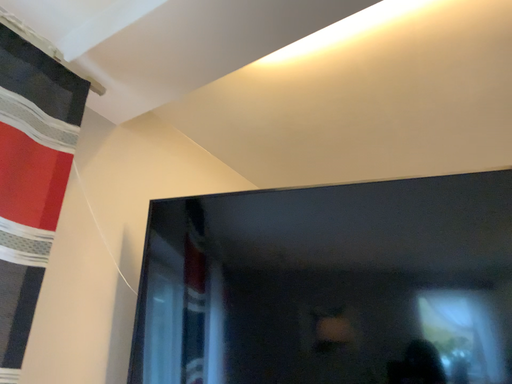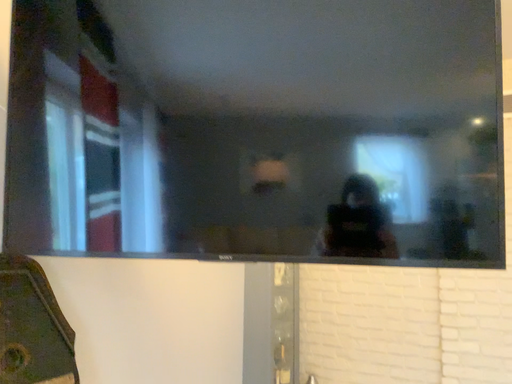
Question: Which way did the camera rotate in the video?

Choices:
 (A) rotated upward
 (B) rotated downward

Answer: (B)